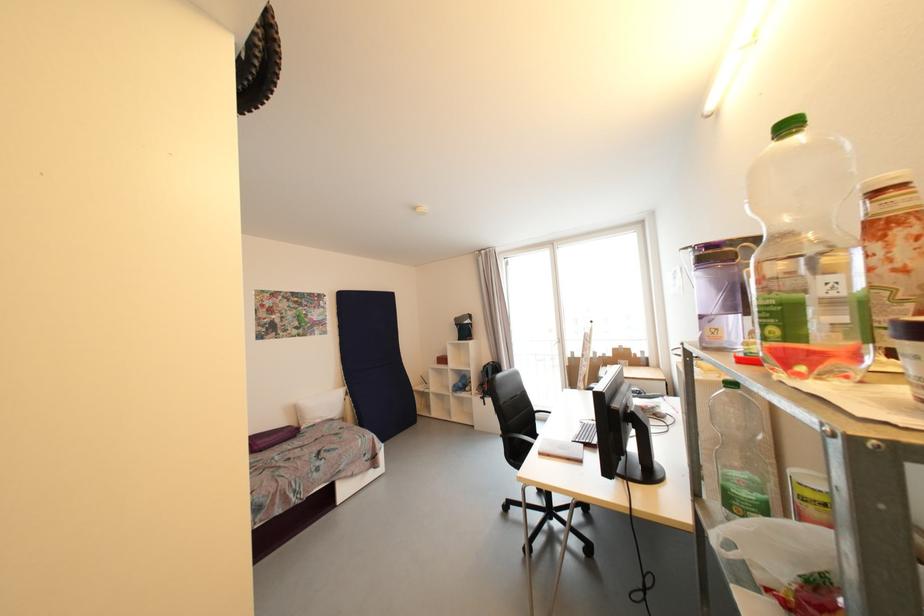
Which object does [271,438] point to?

It corresponds to the purple bolster pillow in the image.